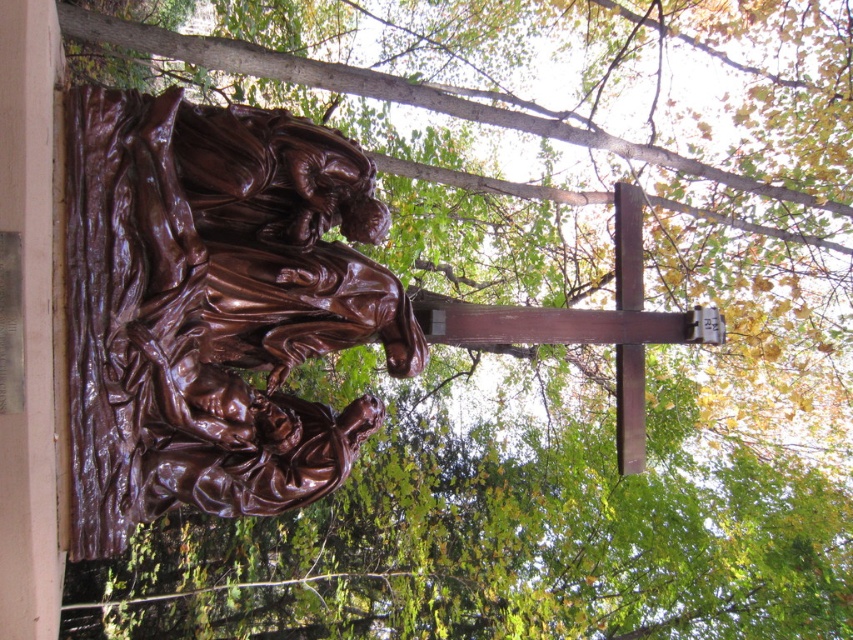
You are an art student visiting a park and see the bronze sculpture at center and the wooden cross at upper center. Which object is closer to you from your viewing position?

The bronze sculpture at center is closer to you than the wooden cross at upper center because it is positioned in front of it.

You are standing in front of the bronze sculpture at center in the park. There is a point marked at coordinates [213,307]. Where is this point located?

The point at [213,307] is on the bronze sculpture at center.

You are a photographer wanting to capture both the bronze sculpture at center and the wooden cross at upper center in a single frame. Based on their positions, which object should you position closer to the left side of your camera viewfinder?

The bronze sculpture at center should be positioned closer to the left side of your camera viewfinder because it is located to the left of the wooden cross at upper center in the scene.